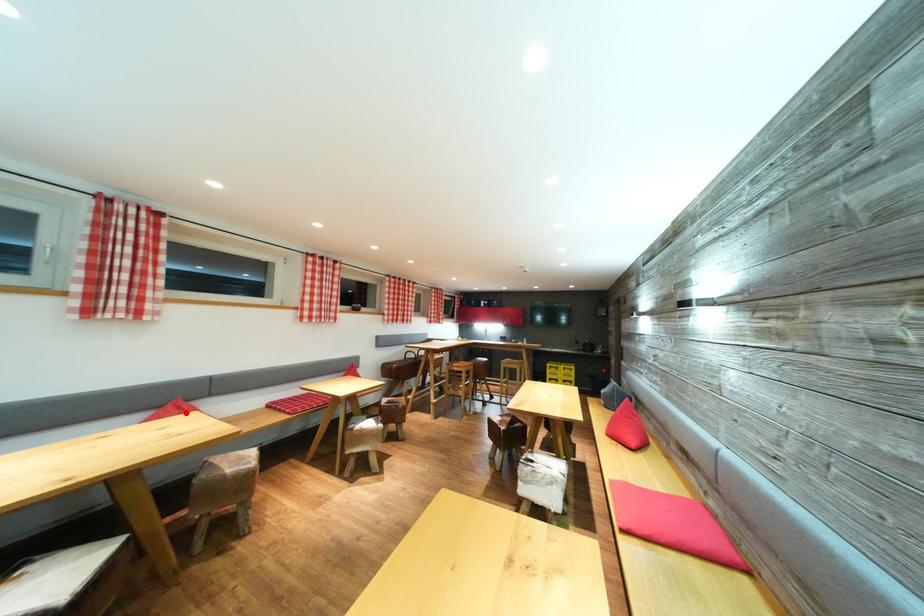
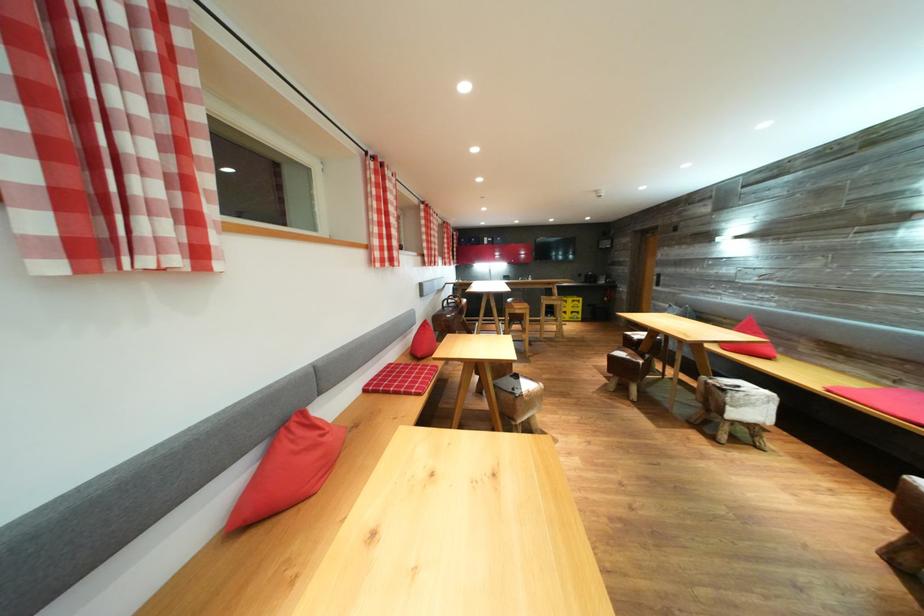
Question: A red point is marked in image1. In image2, is the corresponding 3D point closer to the camera or farther? Reply with the corresponding letter.

Choices:
 (A) The corresponding 3D point is closer.
 (B) The corresponding 3D point is farther.

Answer: (A)